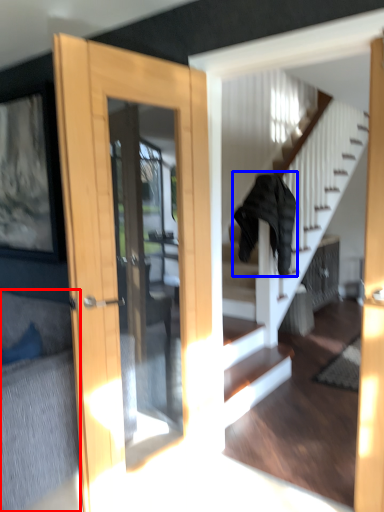
Question: Which object is closer to the camera taking this photo, couch (highlighted by a red box) or clothing (highlighted by a blue box)?

Choices:
 (A) couch
 (B) clothing

Answer: (A)